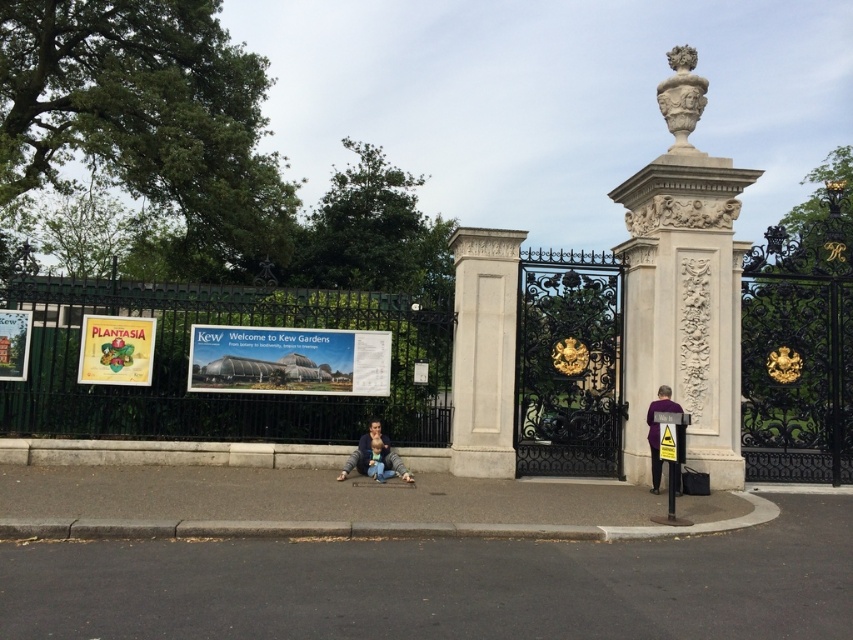
Question: Where is white marble statue at upper right located in relation to matte blue jacket at center in the image?

Choices:
 (A) above
 (B) below

Answer: (A)

Question: Which of the following is the farthest from the observer?

Choices:
 (A) (717, 314)
 (B) (368, 452)

Answer: (A)

Question: Does green wrought iron fence at center have a lesser width compared to purple fabric jacket at lower right?

Choices:
 (A) no
 (B) yes

Answer: (A)

Question: Which of the following is the farthest from the observer?

Choices:
 (A) white stone vase at upper right
 (B) purple fabric jacket at lower right

Answer: (A)

Question: Can you confirm if green wrought iron fence at center is thinner than white marble statue at upper right?

Choices:
 (A) no
 (B) yes

Answer: (A)

Question: Which object is positioned closest to the green wrought iron fence at center?

Choices:
 (A) white stone column at center
 (B) purple fabric jacket at lower right
 (C) white marble statue at upper right

Answer: (A)